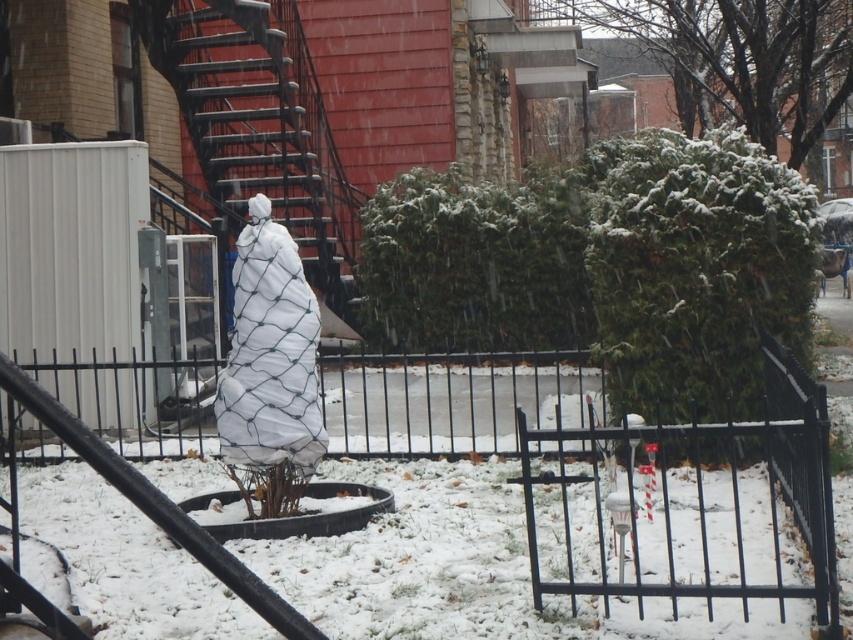
Question: Which point is farther from the camera taking this photo?

Choices:
 (A) (788, 412)
 (B) (225, 42)

Answer: (B)

Question: Does black metal fence at center come behind metallic black staircase at center?

Choices:
 (A) no
 (B) yes

Answer: (A)

Question: Based on their relative distances, which object is nearer to the black metal fence at center?

Choices:
 (A) white mesh bag at center
 (B) metallic black staircase at center

Answer: (A)

Question: Which point is closer to the camera?

Choices:
 (A) white mesh bag at center
 (B) black metal fence at center
 (C) metallic black staircase at center

Answer: (B)

Question: Is black metal fence at center thinner than metallic black staircase at center?

Choices:
 (A) yes
 (B) no

Answer: (A)

Question: Does metallic black staircase at center have a larger size compared to white mesh bag at center?

Choices:
 (A) yes
 (B) no

Answer: (A)